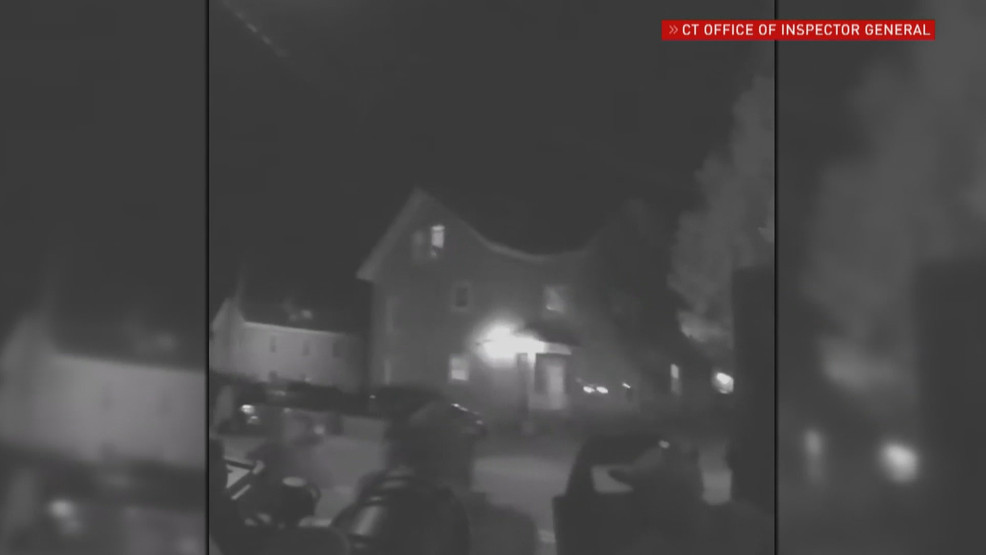
Where is `light`? light is located at coordinates (493, 355).